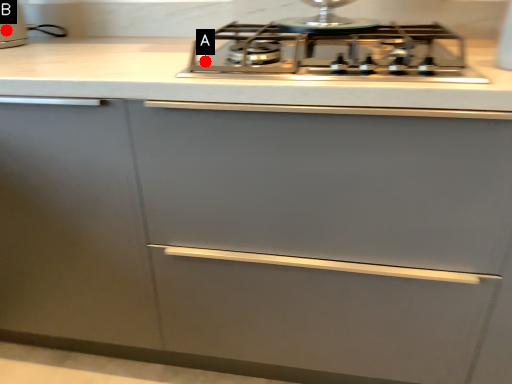
Question: Two points are circled on the image, labeled by A and B beside each circle. Which point is farther from the camera taking this photo?

Choices:
 (A) A is further
 (B) B is further

Answer: (B)